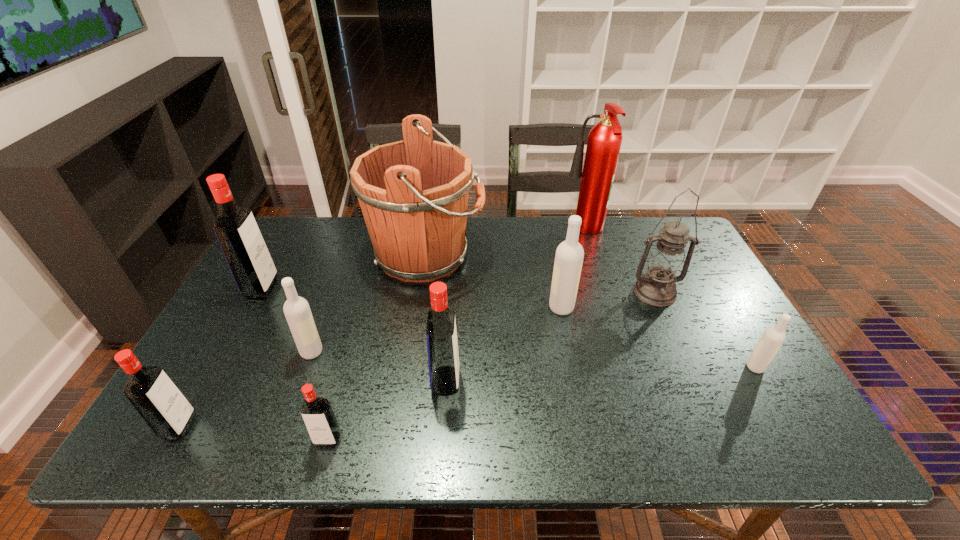
Locate an element on the screen. Image resolution: width=960 pixels, height=540 pixels. red fire extinguisher is located at coordinates (604, 141).

The height and width of the screenshot is (540, 960). Find the location of `the eighth object from left to right`. the eighth object from left to right is located at coordinates coord(604,141).

Identify the location of bucket. [413, 194].

This screenshot has width=960, height=540. In order to click on the tallest vodka in this screenshot , I will do `click(249, 260)`.

What are the coordinates of `the farthest red vodka` in the screenshot? It's located at (249, 260).

Locate an element on the screen. Image resolution: width=960 pixels, height=540 pixels. oil lamp is located at coordinates 666,264.

The width and height of the screenshot is (960, 540). Find the location of `gray oil lamp`. gray oil lamp is located at coordinates tap(666, 264).

Identify the location of the seventh object from left to right. (569, 256).

Where is `the sixth vodka from left to right`? This screenshot has width=960, height=540. the sixth vodka from left to right is located at coordinates (569, 256).

Identify the location of the second farthest red vodka. This screenshot has width=960, height=540. point(443,358).